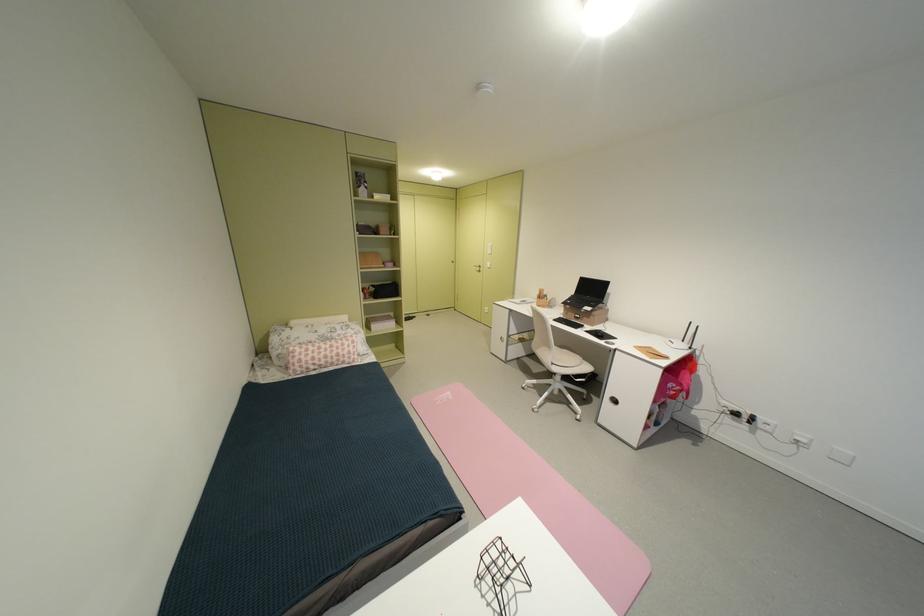
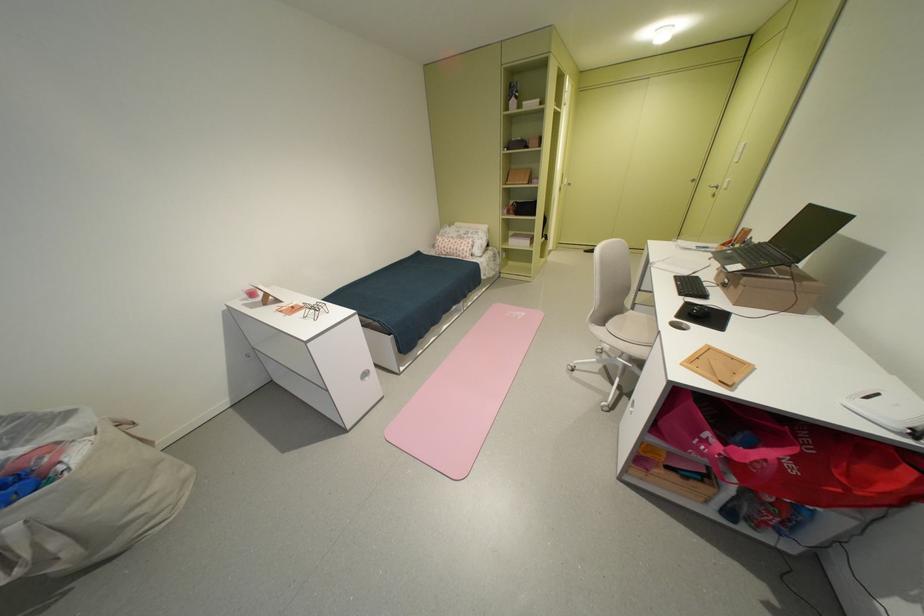
In the second image, find the point that corresponds to [353,357] in the first image.

(468, 252)